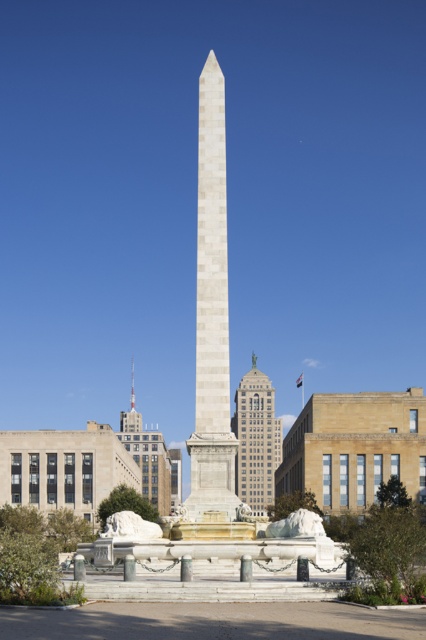
Question: Does white marble obelisk at center have a lesser width compared to gray stone building at center?

Choices:
 (A) no
 (B) yes

Answer: (B)

Question: Which point is farther to the camera?

Choices:
 (A) (224, 387)
 (B) (261, 448)

Answer: (B)

Question: In this image, where is white marble obelisk at center located relative to gray stone building at center?

Choices:
 (A) below
 (B) above

Answer: (B)

Question: Is white marble obelisk at center in front of gray stone building at center?

Choices:
 (A) no
 (B) yes

Answer: (B)

Question: Which of the following is the farthest from the observer?

Choices:
 (A) white marble obelisk at center
 (B) gray stone building at center

Answer: (B)

Question: Which object appears farthest from the camera in this image?

Choices:
 (A) gray stone building at center
 (B) white marble obelisk at center

Answer: (A)